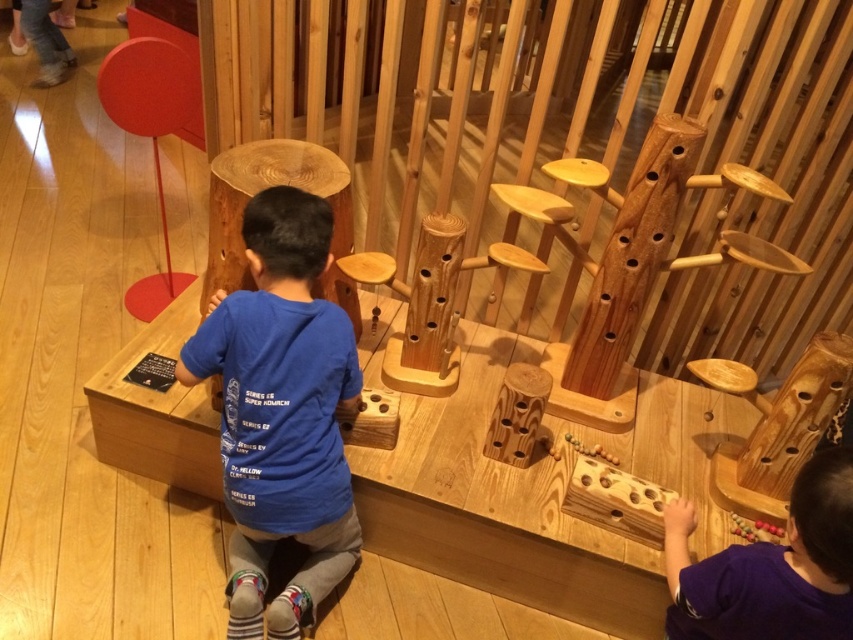
Question: Is blue cotton shirt at center closer to the viewer compared to purple matte shirt at lower right?

Choices:
 (A) no
 (B) yes

Answer: (A)

Question: Can you confirm if blue cotton shirt at center is positioned below purple matte shirt at lower right?

Choices:
 (A) yes
 (B) no

Answer: (B)

Question: Which of the following is the closest to the observer?

Choices:
 (A) (755, 577)
 (B) (229, 406)

Answer: (A)

Question: Does blue cotton shirt at center have a smaller size compared to purple matte shirt at lower right?

Choices:
 (A) yes
 (B) no

Answer: (B)